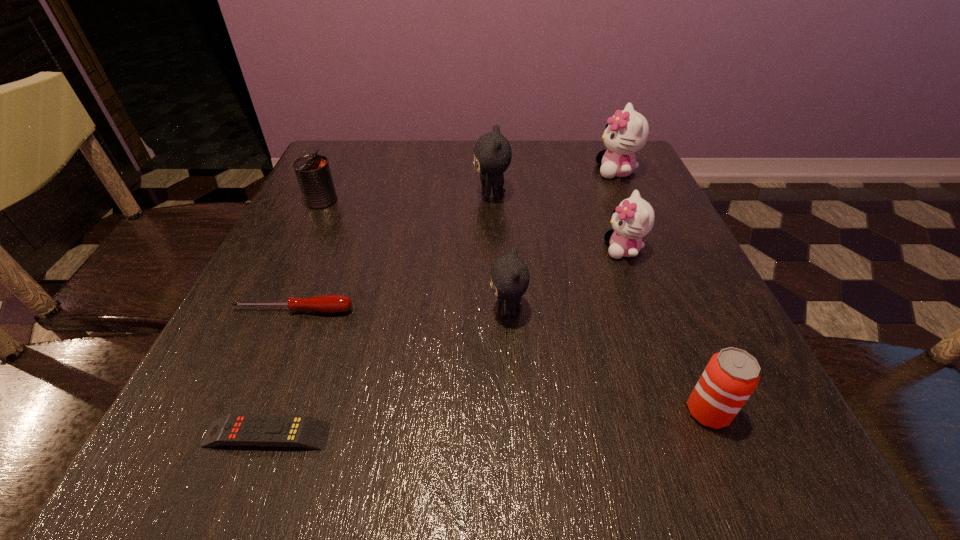
You are a GUI agent. You are given a task and a screenshot of the screen. Output one action in this format:
    pyautogui.click(x=<x>, y=<y>)
    Task: Click on the vacant space at the right edge of the desktop
    
    Given the screenshot: What is the action you would take?
    pyautogui.click(x=660, y=260)

In the image, there is a desktop. At what (x,y) coordinates should I click in order to perform the action: click on vacant space at the far left corner. Please return your answer as a coordinate pair (x, y). This screenshot has height=540, width=960. Looking at the image, I should click on (334, 157).

The image size is (960, 540). In the image, there is a desktop. In order to click on free space at the near right corner in this screenshot , I will do `click(698, 446)`.

The width and height of the screenshot is (960, 540). I want to click on unoccupied position between the bigger gray kitten and the beer can, so click(x=600, y=303).

This screenshot has height=540, width=960. I want to click on free point between the remote control and the farther white kitten, so click(x=442, y=303).

In order to click on free space between the smaller white kitten and the nearest kitten in this screenshot , I will do `click(565, 280)`.

This screenshot has width=960, height=540. Find the location of `vacant area that lies between the can and the remote control`. vacant area that lies between the can and the remote control is located at coordinates click(x=294, y=318).

At what (x,y) coordinates should I click in order to perform the action: click on free space between the screwdriver and the shortest object. Please return your answer as a coordinate pair (x, y). Looking at the image, I should click on (280, 373).

Where is `vacant space in between the yellow remote control and the second nearest kitten`? The width and height of the screenshot is (960, 540). vacant space in between the yellow remote control and the second nearest kitten is located at coordinates (445, 342).

Identify the location of unoccupied position between the second shortest object and the farther white kitten. This screenshot has width=960, height=540. (455, 241).